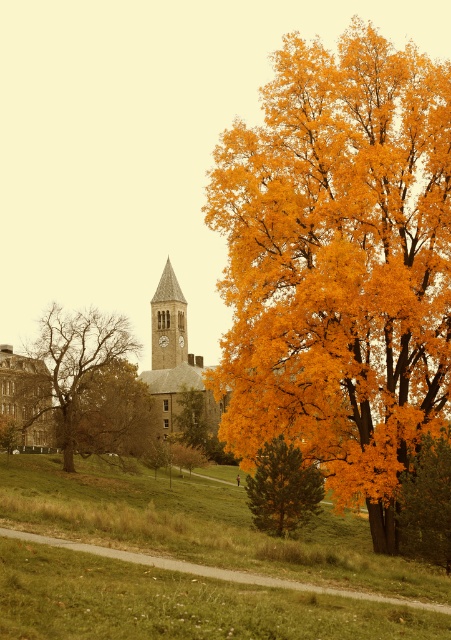
Question: Is smooth stone clock tower at center below brown textured tree at lower left?

Choices:
 (A) no
 (B) yes

Answer: (A)

Question: Which of the following is the farthest from the observer?

Choices:
 (A) green matte tree at center
 (B) golden textured tree at center
 (C) bare branches at left

Answer: (B)

Question: Among these objects, which one is farthest from the camera?

Choices:
 (A) smooth stone clock tower at center
 (B) golden textured tree at center
 (C) golden yellow leaves at right
 (D) stone clock tower at center

Answer: (A)

Question: Estimate the real-world distances between objects in this image. Which object is farther from the bare branches at left?

Choices:
 (A) brown textured tree at lower left
 (B) smooth stone clock tower at center

Answer: (B)

Question: Is green matte tree at center bigger than smooth stone clock tower at center?

Choices:
 (A) no
 (B) yes

Answer: (A)

Question: Can you confirm if brown textured tree at center-left is positioned to the left of brown textured tree at lower left?

Choices:
 (A) no
 (B) yes

Answer: (A)